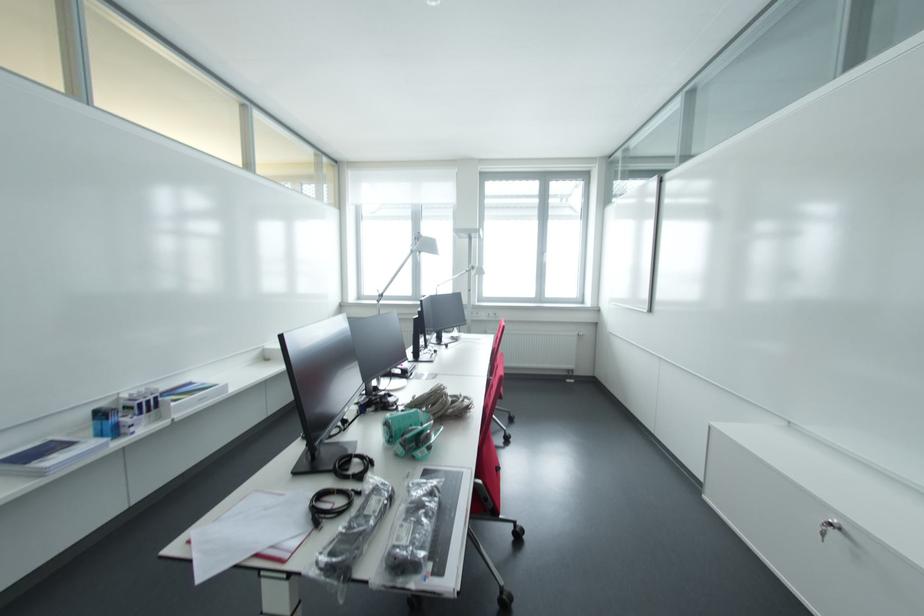
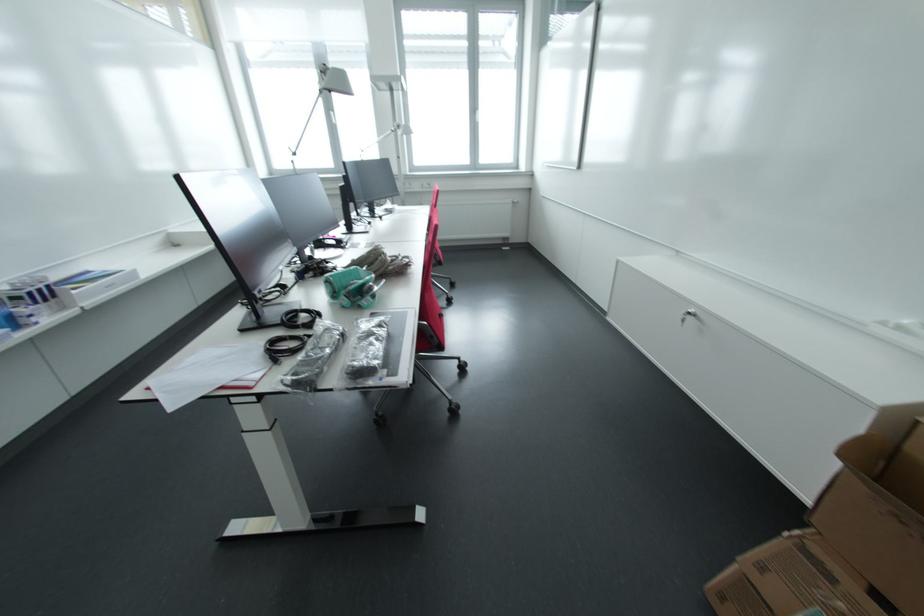
In the second image, find the point that corresponds to point 476,270 in the first image.

(403, 128)